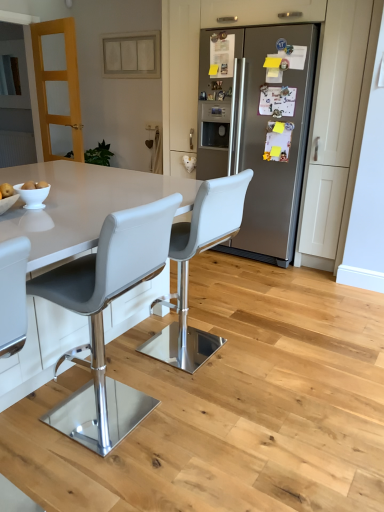
Image resolution: width=384 pixels, height=512 pixels. I want to click on vacant space situated on the left part of white leather stool at center, the second chair positioned from the back, so click(39, 415).